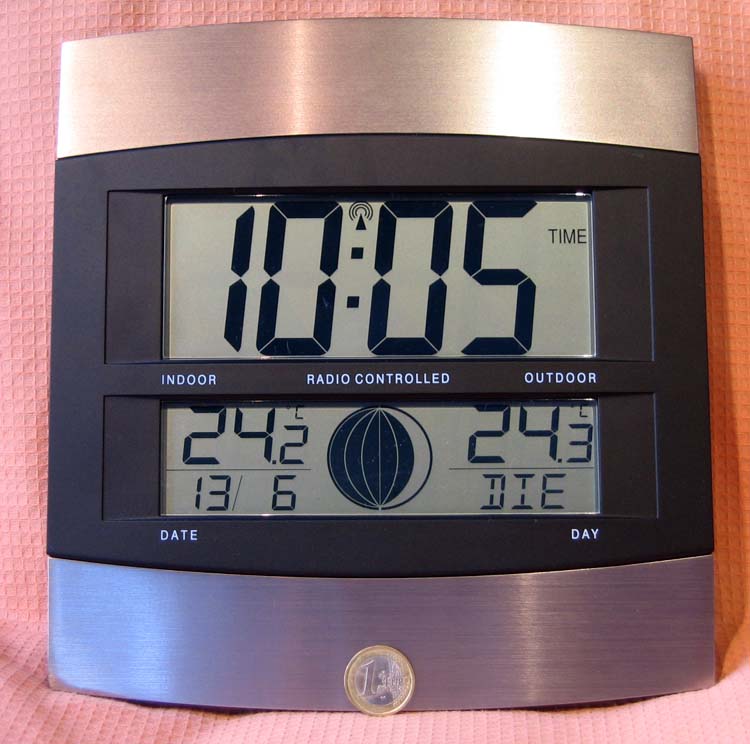
You are a GUI agent. You are given a task and a screenshot of the screen. Output one action in this format:
    pyautogui.click(x=<x>, y=<y>)
    Task: Click on the clock
    The image size is (750, 744).
    Given the screenshot: What is the action you would take?
    (136, 660)